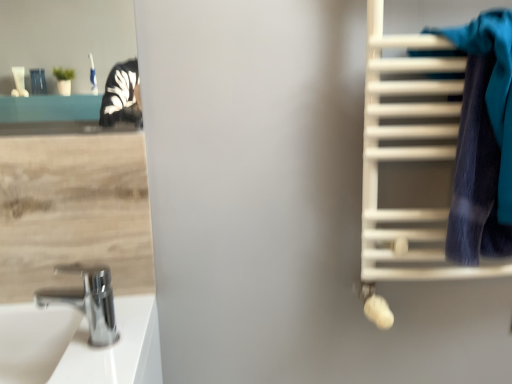
Question: Is blue fabric towel at right oriented towards chrome metallic faucet at lower left?

Choices:
 (A) no
 (B) yes

Answer: (A)

Question: From a real-world perspective, is blue fabric towel at right located higher than chrome metallic faucet at lower left?

Choices:
 (A) no
 (B) yes

Answer: (B)

Question: Does blue fabric towel at right have a greater height compared to chrome metallic faucet at lower left?

Choices:
 (A) no
 (B) yes

Answer: (B)

Question: Is blue fabric towel at right in contact with chrome metallic faucet at lower left?

Choices:
 (A) no
 (B) yes

Answer: (A)

Question: Can you confirm if blue fabric towel at right is shorter than chrome metallic faucet at lower left?

Choices:
 (A) yes
 (B) no

Answer: (B)

Question: Does blue fabric towel at right have a larger size compared to chrome metallic faucet at lower left?

Choices:
 (A) no
 (B) yes

Answer: (B)

Question: Does white glossy sink at lower left have a lesser width compared to blue fabric towel at right?

Choices:
 (A) no
 (B) yes

Answer: (A)

Question: Is white glossy sink at lower left positioned behind blue fabric towel at right?

Choices:
 (A) yes
 (B) no

Answer: (A)

Question: Is white glossy sink at lower left looking in the opposite direction of blue fabric towel at right?

Choices:
 (A) yes
 (B) no

Answer: (B)

Question: Is white glossy sink at lower left next to blue fabric towel at right?

Choices:
 (A) no
 (B) yes

Answer: (A)

Question: From a real-world perspective, is white glossy sink at lower left under blue fabric towel at right?

Choices:
 (A) no
 (B) yes

Answer: (B)

Question: Considering the relative sizes of white glossy sink at lower left and blue fabric towel at right in the image provided, is white glossy sink at lower left taller than blue fabric towel at right?

Choices:
 (A) no
 (B) yes

Answer: (A)

Question: Is white matte towel rack at right behind chrome metallic faucet at lower left?

Choices:
 (A) no
 (B) yes

Answer: (A)